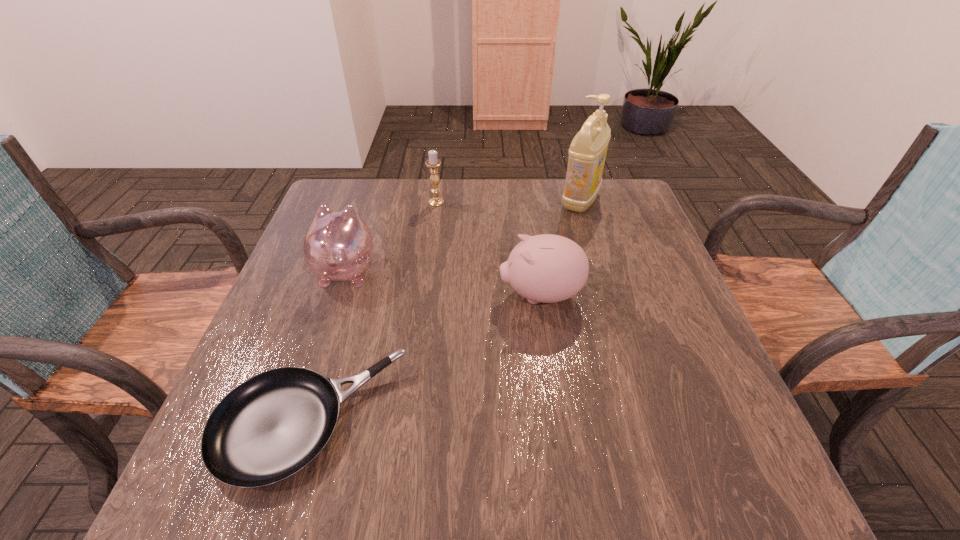
Find the location of `free location that satisfies the following two spatial constraints: 1. on the front facing side of the left piggy bank; 2. on the right side of the tallest object`. free location that satisfies the following two spatial constraints: 1. on the front facing side of the left piggy bank; 2. on the right side of the tallest object is located at coordinates 369,200.